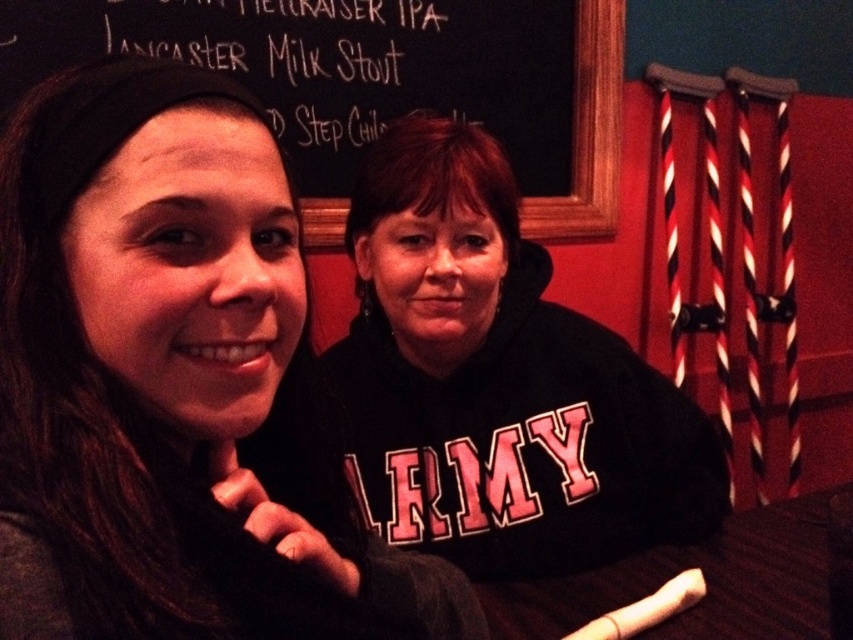
Does matte black hoodie at center have a smaller size compared to black chalkboard at upper center?

Actually, matte black hoodie at center might be larger than black chalkboard at upper center.

Is point (107, 632) closer to viewer compared to point (590, 192)?

Yes, it is in front of point (590, 192).

I want to click on matte black hoodie at center, so click(173, 385).